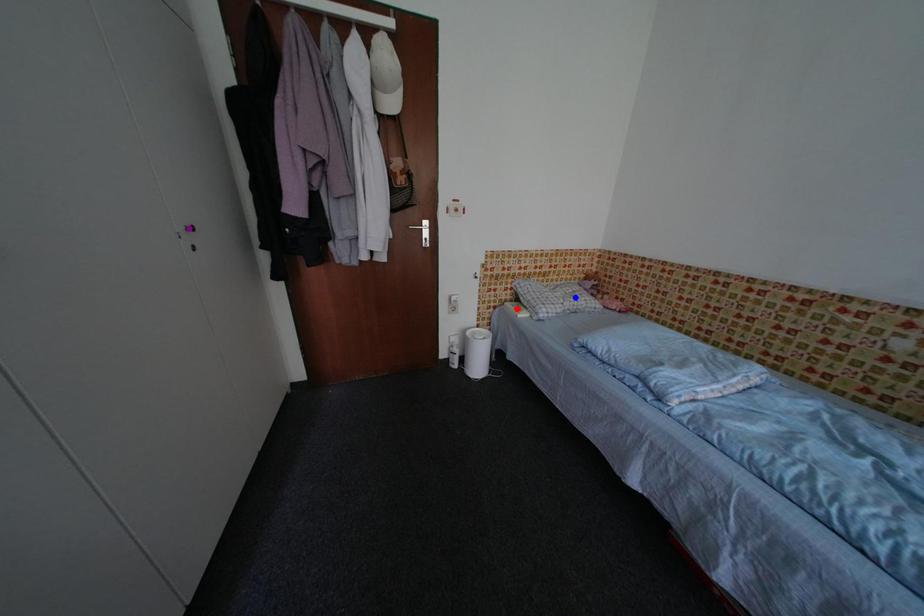
Order these from farthest to nearest:
- purple point
- blue point
- red point

red point → blue point → purple point